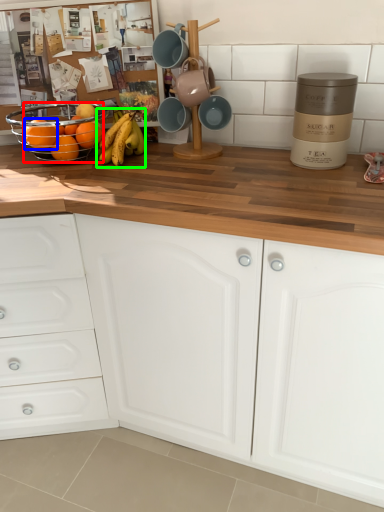
Question: Estimate the real-world distances between objects in this image. Which object is farther from orange (highlighted by a red box), orange (highlighted by a blue box) or banana (highlighted by a green box)?

Choices:
 (A) orange
 (B) banana

Answer: (B)